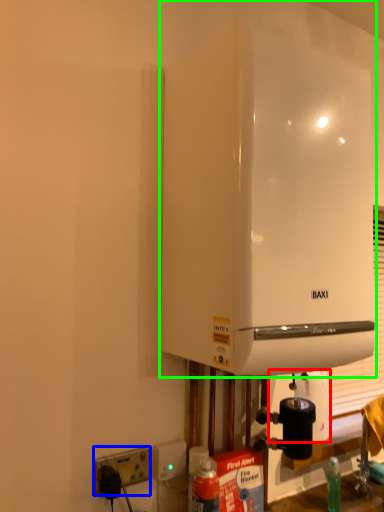
Question: Estimate the real-world distances between objects in this image. Which object is closer to paper towel (highlighted by a red box), electric outlet (highlighted by a blue box) or home appliance (highlighted by a green box)?

Choices:
 (A) electric outlet
 (B) home appliance

Answer: (A)